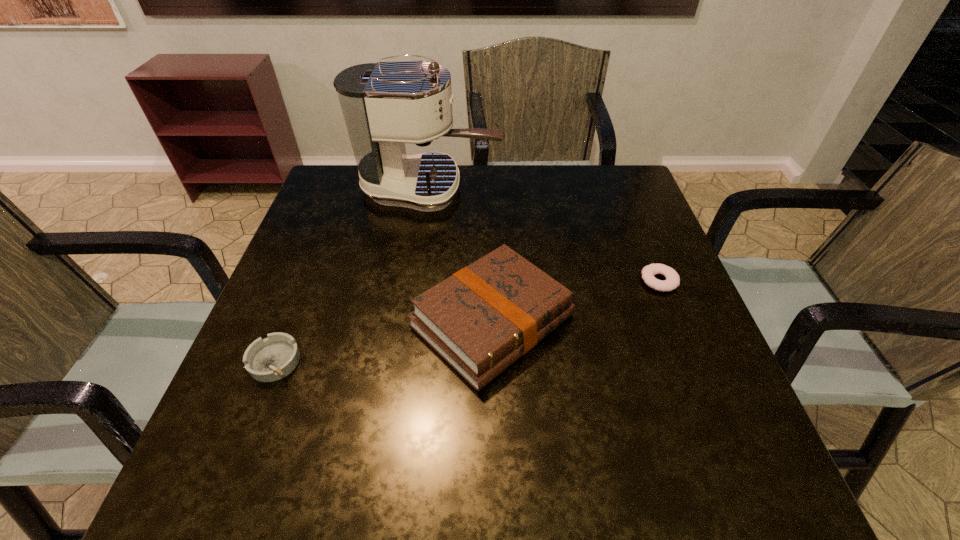
The width and height of the screenshot is (960, 540). I want to click on vacant space at the far left corner of the desktop, so click(x=346, y=186).

Where is `free spot at the near left corner of the desktop`? The image size is (960, 540). free spot at the near left corner of the desktop is located at coordinates (198, 501).

The height and width of the screenshot is (540, 960). In the image, there is a desktop. What are the coordinates of `vacant space at the far right corner` in the screenshot? It's located at (589, 214).

The width and height of the screenshot is (960, 540). In order to click on empty location between the hardback book and the third tallest object in this screenshot , I will do `click(384, 341)`.

Locate an element on the screen. vacant region between the coffee maker and the second tallest object is located at coordinates (461, 255).

The height and width of the screenshot is (540, 960). In order to click on empty space between the hardback book and the second shortest object in this screenshot , I will do `click(384, 341)`.

Where is `free space between the shortest object and the hardback book`? free space between the shortest object and the hardback book is located at coordinates (576, 301).

Find the location of a particular element. The width and height of the screenshot is (960, 540). empty space that is in between the hardback book and the farthest object is located at coordinates (461, 255).

Locate an element on the screen. The image size is (960, 540). free space between the ashtray and the farthest object is located at coordinates (352, 275).

Where is `unoccupied area between the second shortest object and the farthest object`? This screenshot has height=540, width=960. unoccupied area between the second shortest object and the farthest object is located at coordinates (352, 275).